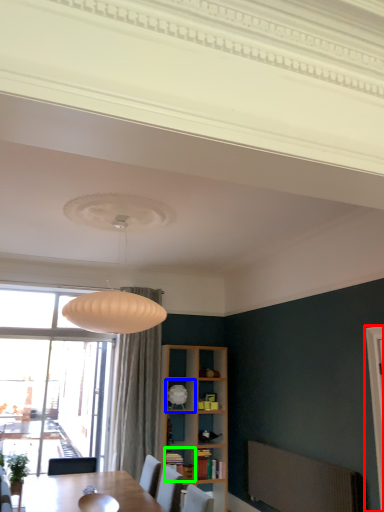
Question: Which object is positioned closest to screen door (highlighted by a red box)? Select from shelf (highlighted by a blue box) and shelf (highlighted by a green box).

Choices:
 (A) shelf
 (B) shelf

Answer: (B)